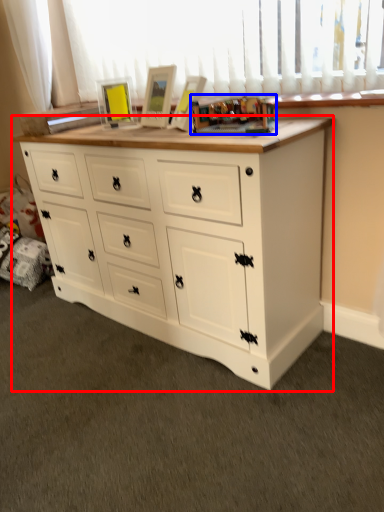
Question: Which object appears closest to the camera in this image, chest of drawers (highlighted by a red box) or toy (highlighted by a blue box)?

Choices:
 (A) chest of drawers
 (B) toy

Answer: (A)